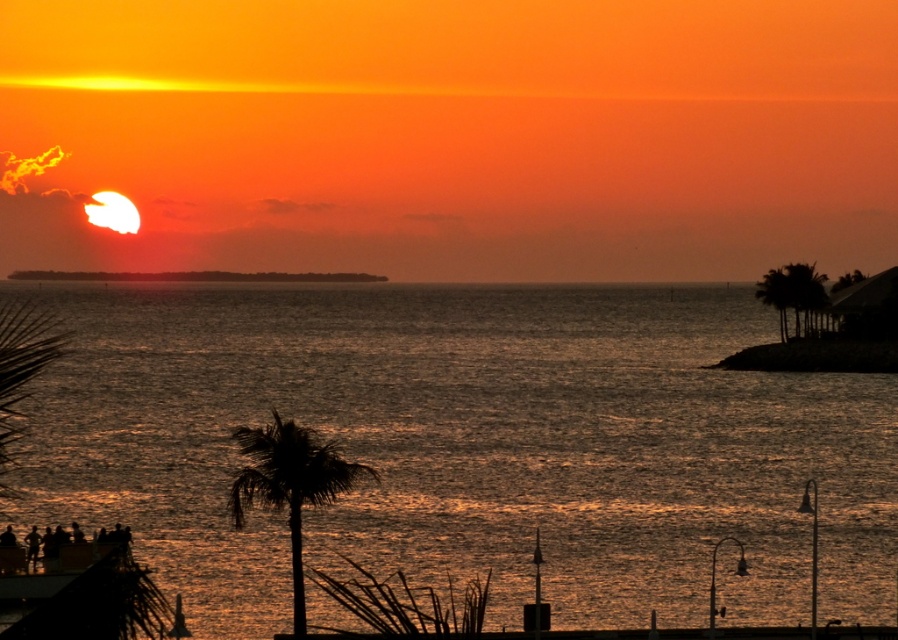
In the scene shown: You are standing at the point closest to the camera in the sunset scene. Which point are you at, point [548,532] or point [759,291]?

You are at point [548,532] because it is closer to the camera than point [759,291].

You are an artist trying to paint the sunset scene. You want to place the shiny metallic water at center and the silhouette leafy palm at lower center in your painting. Based on the scene description, which object should you draw first to ensure proper layering?

The silhouette leafy palm at lower center should be drawn first because the shiny metallic water at center is positioned on the left side of it, meaning the palm is in front and needs to be layered over the water.